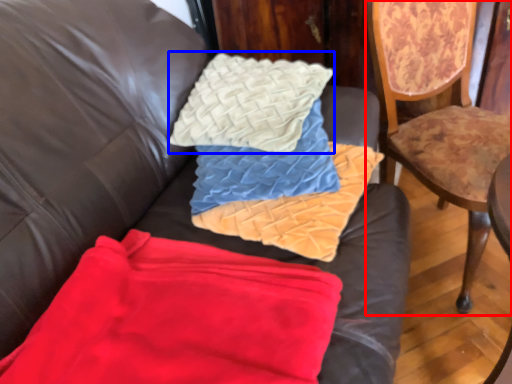
Question: Which object is further to the camera taking this photo, chair (highlighted by a red box) or throw pillow (highlighted by a blue box)?

Choices:
 (A) chair
 (B) throw pillow

Answer: (B)